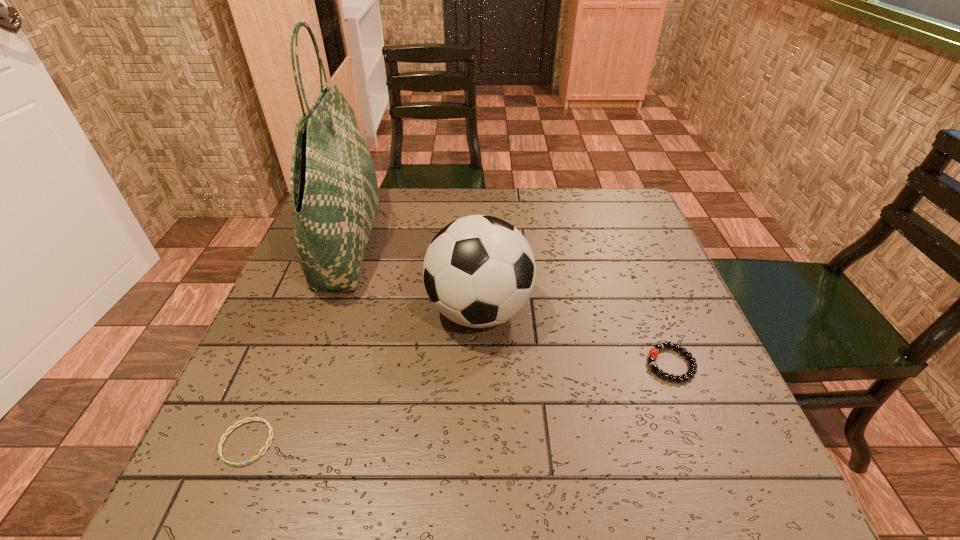
Locate an element on the screen. object that is at the far edge is located at coordinates (333, 184).

Find the location of a particular element. This screenshot has height=540, width=960. object situated at the near edge is located at coordinates (254, 418).

Where is `tote bag located at the left edge`? tote bag located at the left edge is located at coordinates (333, 184).

Locate an element on the screen. The height and width of the screenshot is (540, 960). bracelet that is at the left edge is located at coordinates (254, 418).

Locate an element on the screen. The width and height of the screenshot is (960, 540). object present at the right edge is located at coordinates (653, 353).

The height and width of the screenshot is (540, 960). I want to click on object that is at the far left corner, so click(333, 184).

You are a GUI agent. You are given a task and a screenshot of the screen. Output one action in this format:
    pyautogui.click(x=<x>, y=<y>)
    Task: Click on the object that is at the near left corner
    
    Given the screenshot: What is the action you would take?
    tap(254, 418)

Where is `blank space at the far edge of the desktop`? blank space at the far edge of the desktop is located at coordinates (536, 205).

The image size is (960, 540). What are the coordinates of `free space at the near edge of the desktop` in the screenshot? It's located at (539, 495).

This screenshot has height=540, width=960. I want to click on free space at the left edge, so click(324, 297).